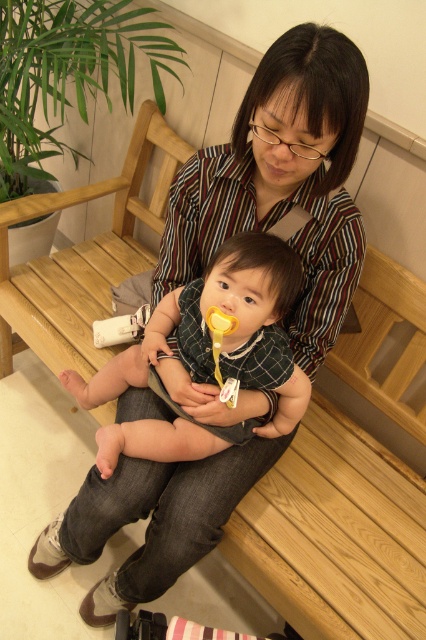
Question: Which of the following is the farthest from the observer?

Choices:
 (A) soft yellow pacifier at center
 (B) yellow rubber spoon at center

Answer: (B)

Question: Is the position of soft yellow pacifier at center less distant than that of yellow rubber spoon at center?

Choices:
 (A) no
 (B) yes

Answer: (B)

Question: Which point is farther to the camera?

Choices:
 (A) soft yellow pacifier at center
 (B) yellow rubber spoon at center

Answer: (B)

Question: Is soft yellow pacifier at center closer to camera compared to yellow rubber spoon at center?

Choices:
 (A) yes
 (B) no

Answer: (A)

Question: Can you confirm if soft yellow pacifier at center is smaller than yellow rubber spoon at center?

Choices:
 (A) no
 (B) yes

Answer: (A)